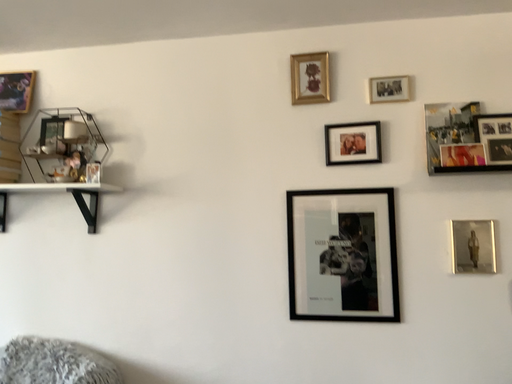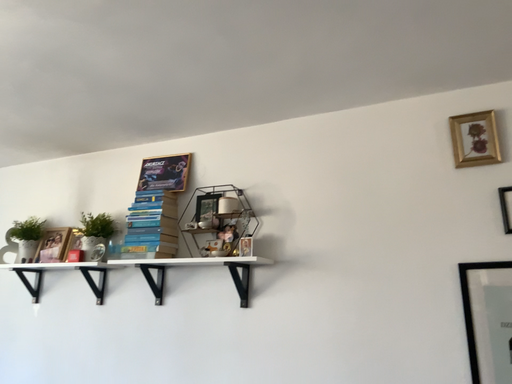
Question: How did the camera likely rotate when shooting the video?

Choices:
 (A) rotated downward
 (B) rotated upward

Answer: (B)